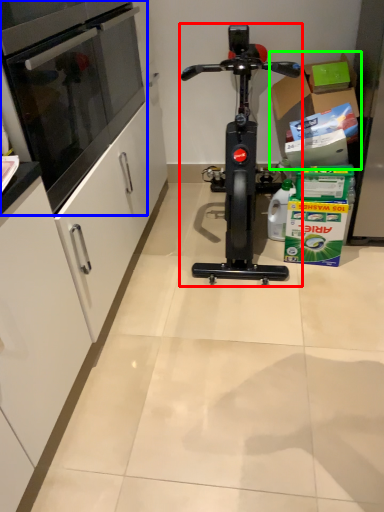
Question: Based on their relative distances, which object is nearer to stationary bicycle (highlighted by a red box)? Choose from oven (highlighted by a blue box) and cardboard box (highlighted by a green box).

Choices:
 (A) oven
 (B) cardboard box

Answer: (B)